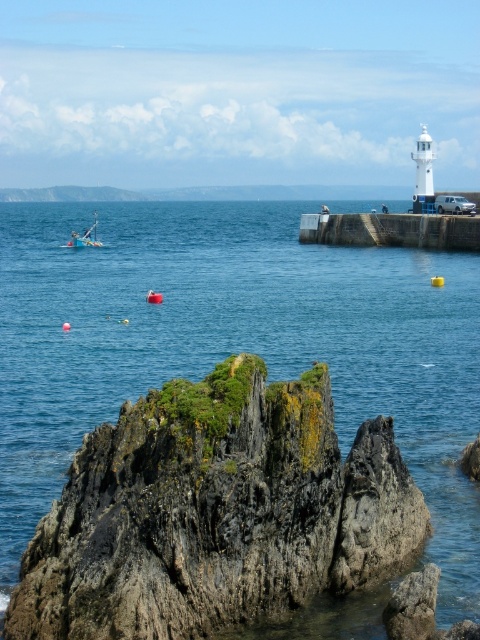
Between concrete at right and yellow plastic boat at left, which one has more height?

yellow plastic boat at left is taller.

Does concrete at right lie in front of yellow plastic boat at left?

Yes, concrete at right is in front of yellow plastic boat at left.

Locate an element on the screen. concrete at right is located at coordinates (392, 230).

At what (x,y) coordinates should I click in order to perform the action: click on concrete at right. Please return your answer as a coordinate pair (x, y). Looking at the image, I should click on (392, 230).

The height and width of the screenshot is (640, 480). In order to click on blue water at center in this screenshot , I will do `click(232, 342)`.

Is point (232, 225) behind point (375, 224)?

Yes, point (232, 225) is behind point (375, 224).

Image resolution: width=480 pixels, height=640 pixels. Describe the element at coordinates (232, 342) in the screenshot. I see `blue water at center` at that location.

This screenshot has height=640, width=480. I want to click on blue water at center, so click(232, 342).

Is blue water at center smaller than yellow plastic boat at left?

Actually, blue water at center might be larger than yellow plastic boat at left.

Which of these two, blue water at center or yellow plastic boat at left, stands taller?

Standing taller between the two is blue water at center.

Who is more forward, (396, 268) or (86, 228)?

Point (396, 268) is in front.

What are the coordinates of `blue water at center` in the screenshot? It's located at (232, 342).